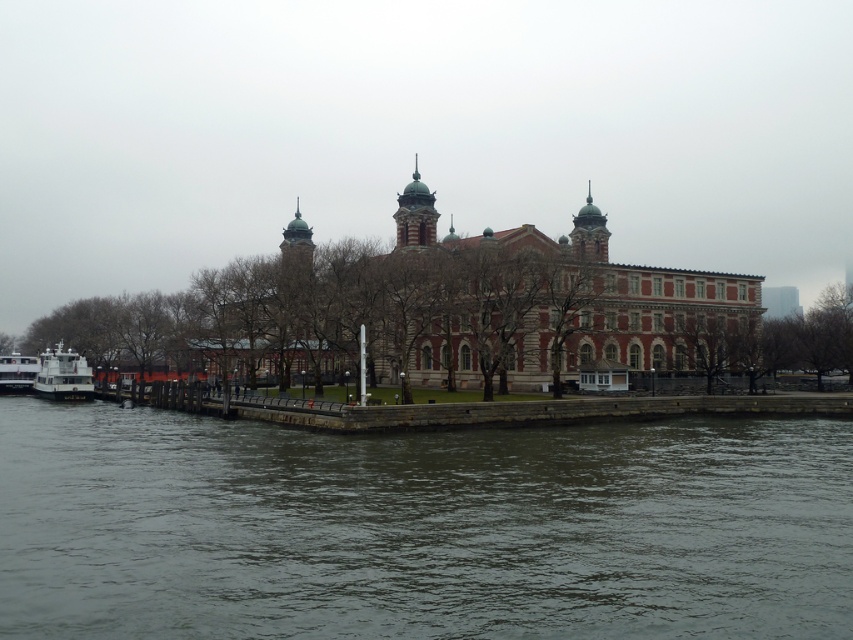
Is white glossy ferry at lower left taller than green stone tower at center?

No.

Does point (91, 385) come in front of point (289, 289)?

That is False.

Locate an element on the screen. The width and height of the screenshot is (853, 640). white glossy ferry at lower left is located at coordinates (62, 376).

Can you confirm if white glossy ferry at lower left is taller than white glossy boat at lower left?

Correct, white glossy ferry at lower left is much taller as white glossy boat at lower left.

Does white glossy ferry at lower left have a larger size compared to white glossy boat at lower left?

Actually, white glossy ferry at lower left might be smaller than white glossy boat at lower left.

This screenshot has width=853, height=640. Find the location of `white glossy ferry at lower left`. white glossy ferry at lower left is located at coordinates (62, 376).

Can you confirm if smooth concrete dock at lower center is positioned above white glossy boat at lower left?

Incorrect, smooth concrete dock at lower center is not positioned above white glossy boat at lower left.

The image size is (853, 640). What do you see at coordinates (518, 410) in the screenshot? I see `smooth concrete dock at lower center` at bounding box center [518, 410].

Identify the location of smooth concrete dock at lower center. (518, 410).